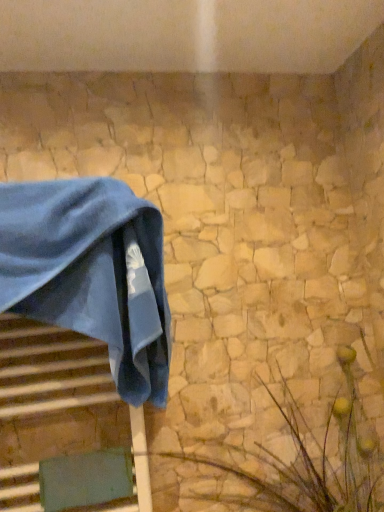
Question: From a real-world perspective, is green textured plant at lower right physically located above or below blue velvet towel at left?

Choices:
 (A) below
 (B) above

Answer: (A)

Question: Considering the relative positions of green textured plant at lower right and blue velvet towel at left in the image provided, is green textured plant at lower right to the left or to the right of blue velvet towel at left?

Choices:
 (A) right
 (B) left

Answer: (A)

Question: Choose the correct answer: Is green textured plant at lower right inside blue velvet towel at left or outside it?

Choices:
 (A) inside
 (B) outside

Answer: (B)

Question: Is blue velvet towel at left situated inside green textured plant at lower right or outside?

Choices:
 (A) outside
 (B) inside

Answer: (A)

Question: Is point (144, 400) positioned closer to the camera than point (307, 507)?

Choices:
 (A) farther
 (B) closer

Answer: (B)

Question: Visually, is blue velvet towel at left positioned to the left or to the right of green textured plant at lower right?

Choices:
 (A) right
 (B) left

Answer: (B)

Question: Relative to green textured plant at lower right, is blue velvet towel at left in front or behind?

Choices:
 (A) front
 (B) behind

Answer: (B)